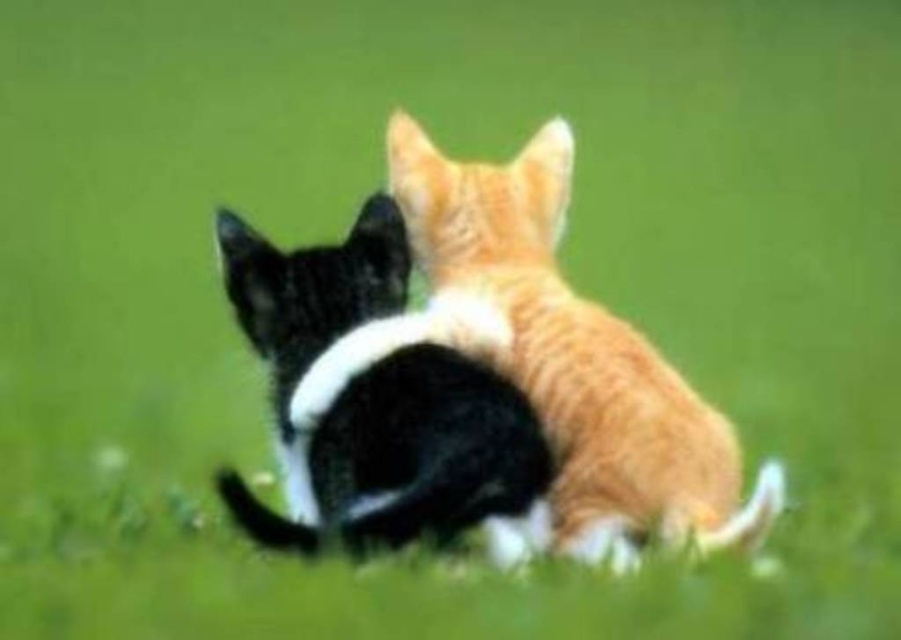
Question: Which object appears farthest from the camera in this image?

Choices:
 (A) black and white fur cat at center
 (B) orange fur cat at center

Answer: (B)

Question: Does orange fur cat at center appear on the right side of black and white fur cat at center?

Choices:
 (A) no
 (B) yes

Answer: (B)

Question: Which of the following is the farthest from the observer?

Choices:
 (A) black and white fur cat at center
 (B) orange fur cat at center

Answer: (B)

Question: Is orange fur cat at center behind black and white fur cat at center?

Choices:
 (A) no
 (B) yes

Answer: (B)

Question: Is orange fur cat at center above black and white fur cat at center?

Choices:
 (A) no
 (B) yes

Answer: (B)

Question: Which of the following is the farthest from the observer?

Choices:
 (A) black and white fur cat at center
 (B) orange fur cat at center

Answer: (B)